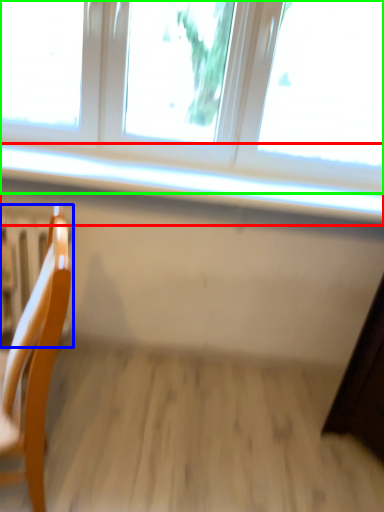
Question: Considering the real-world distances, which object is farthest from window sill (highlighted by a red box)? radiator (highlighted by a blue box) or window (highlighted by a green box)?

Choices:
 (A) radiator
 (B) window

Answer: (A)